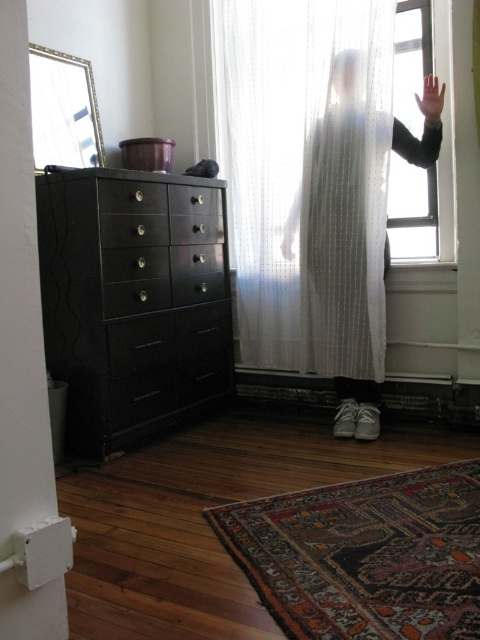
Between white sheer dress at center and translucent white hand at upper right, which one appears on the right side from the viewer's perspective?

translucent white hand at upper right

From the picture: Who is taller, white sheer dress at center or translucent white hand at upper right?

white sheer dress at center

The image size is (480, 640). What do you see at coordinates (340, 186) in the screenshot?
I see `white sheer dress at center` at bounding box center [340, 186].

Find the location of a particular element. Image resolution: width=480 pixels, height=640 pixels. white sheer dress at center is located at coordinates click(x=340, y=186).

Can you confirm if transparent glass window at upper right is positioned to the right of white matte hand at upper center?

Indeed, transparent glass window at upper right is positioned on the right side of white matte hand at upper center.

Is transparent glass window at upper right shorter than white matte hand at upper center?

No.

Measure the distance between point (392, 173) and camera.

Point (392, 173) and camera are 2.95 meters apart.

I want to click on transparent glass window at upper right, so click(411, 211).

Does white sheer dress at center have a greater width compared to black glossy drawer at left?

Yes.

Is white sheer dress at center positioned in front of black glossy drawer at left?

No, white sheer dress at center is behind black glossy drawer at left.

This screenshot has height=640, width=480. What do you see at coordinates (340, 186) in the screenshot? I see `white sheer dress at center` at bounding box center [340, 186].

This screenshot has height=640, width=480. Find the location of `white sheer dress at center`. white sheer dress at center is located at coordinates (340, 186).